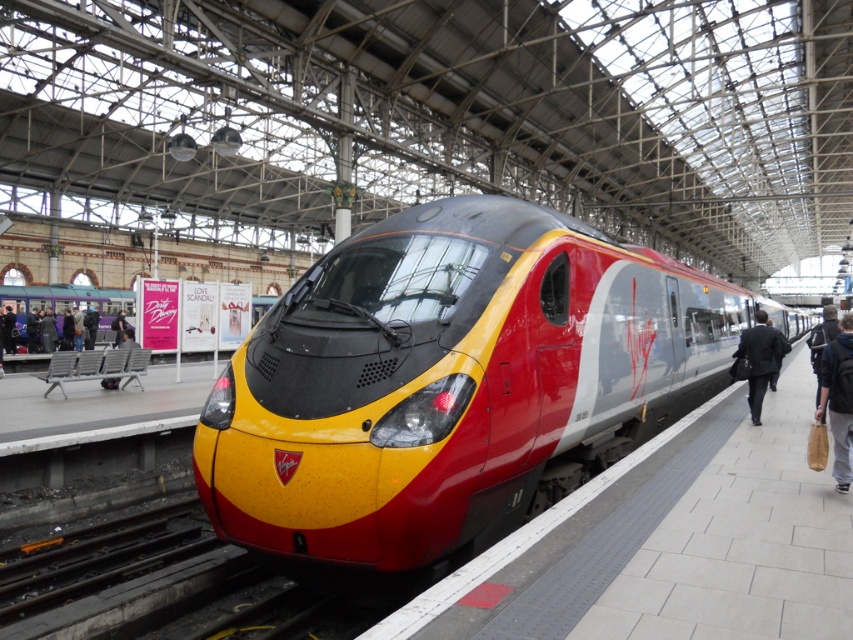
You are standing on the platform at the train station. You see two points marked on the platform. The first point is at coordinate point (35, 308) and the second point is at coordinate point (758, 317). Which point is closer to you?

Point (35, 308) is closer to you because it is further to the camera than point (758, 317).

You are a passenger waiting at the station platform. You see a brown leather bag at right and a dark brown leather jacket at left. Which item is positioned lower on the platform?

The brown leather bag at right is located below the dark brown leather jacket at left, so it is positioned lower on the platform.

You are a passenger waiting at the station platform. You see a brown leather bag at right and a dark brown leather jacket at left. Which item is nearer to you?

The brown leather bag at right is closer to the viewer than the dark brown leather jacket at left.